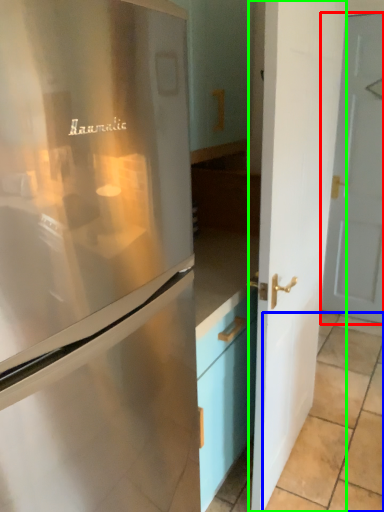
Question: Estimate the real-world distances between objects in this image. Which object is farther from door (highlighted by a red box), tile (highlighted by a blue box) or door (highlighted by a green box)?

Choices:
 (A) tile
 (B) door

Answer: (B)